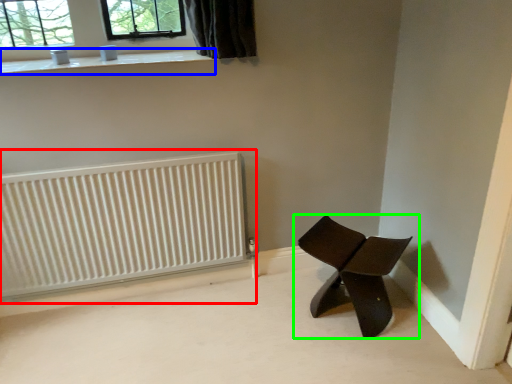
Question: Considering the real-world distances, which object is farthest from radiator (highlighted by a red box)? window sill (highlighted by a blue box) or chair (highlighted by a green box)?

Choices:
 (A) window sill
 (B) chair

Answer: (B)